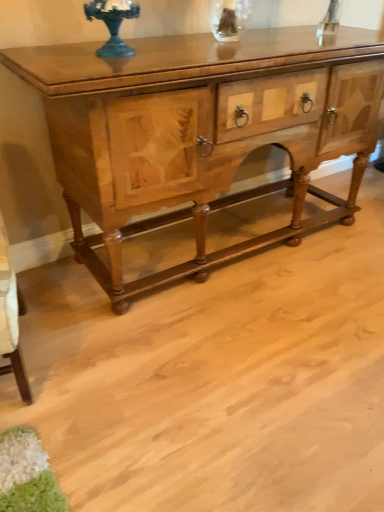
Question: Should I look upward or downward to see wooden cabinet at center?

Choices:
 (A) up
 (B) down

Answer: (A)